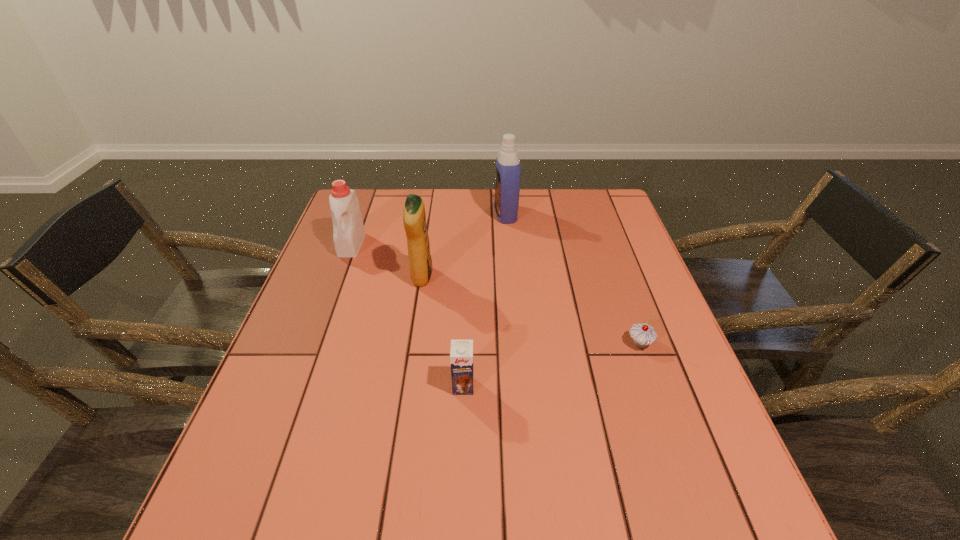
I want to click on free space that satisfies the following two spatial constraints: 1. on the front side of the cupcake; 2. on the left side of the rightmost detergent, so click(x=516, y=343).

Find the location of `vacant region that satisfies the following two spatial constraints: 1. on the front side of the rightmost object; 2. on the right side of the rightmost detergent`. vacant region that satisfies the following two spatial constraints: 1. on the front side of the rightmost object; 2. on the right side of the rightmost detergent is located at coordinates (516, 343).